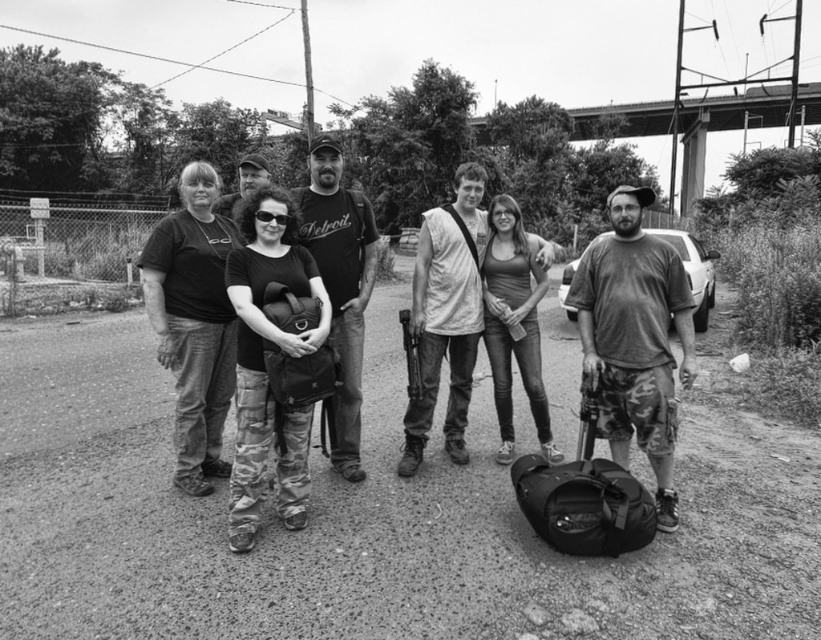
You are navigating a drone over the scene shown. The drone needs to hover exactly at the center point of the dirt track at center. What are the coordinates where the drone should position itself?

The dirt track at center has coordinates at point (372, 522), so the drone should hover at those coordinates to be exactly at its center.